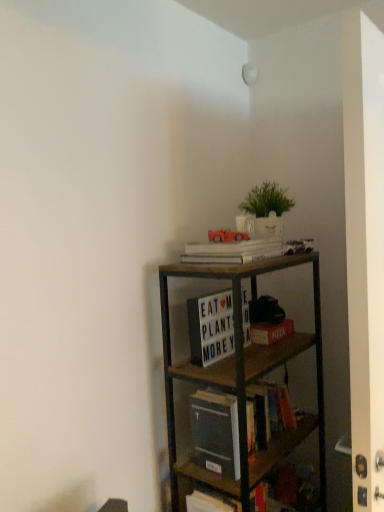
Question: Visually, is white matte book at upper center, marked as the 1th book in a top-to-bottom arrangement, positioned to the left or to the right of green matte plant at upper center?

Choices:
 (A) left
 (B) right

Answer: (A)

Question: Looking at their shapes, would you say white matte book at upper center, acting as the 3th book starting from the bottom, is wider or thinner than green matte plant at upper center?

Choices:
 (A) wide
 (B) thin

Answer: (A)

Question: Considering the real-world distances, which object is closest to the wooden shelf at center?

Choices:
 (A) white matte letter board at center, positioned as the second book in top-to-bottom order
 (B) hardcover book at center, placed as the 3th book when sorted from top to bottom
 (C) green matte plant at upper center
 (D) matte red car at upper center
 (E) red matte paper at center

Answer: (B)

Question: Estimate the real-world distances between objects in this image. Which object is farther from the hardcover book at center, placed as the 3th book when sorted from top to bottom?

Choices:
 (A) white matte letter board at center, positioned as the second book in top-to-bottom order
 (B) white matte book at upper center, marked as the 1th book in a top-to-bottom arrangement
 (C) green matte plant at upper center
 (D) red matte paper at center
 (E) wooden shelf at center

Answer: (C)